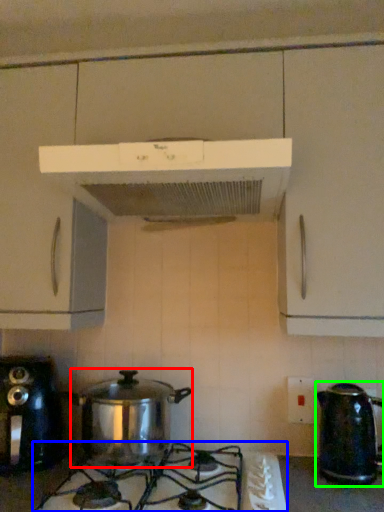
Question: Which is nearer to the crock pot (highlighted by a red box)? gas stove (highlighted by a blue box) or kettle (highlighted by a green box).

Choices:
 (A) gas stove
 (B) kettle

Answer: (A)